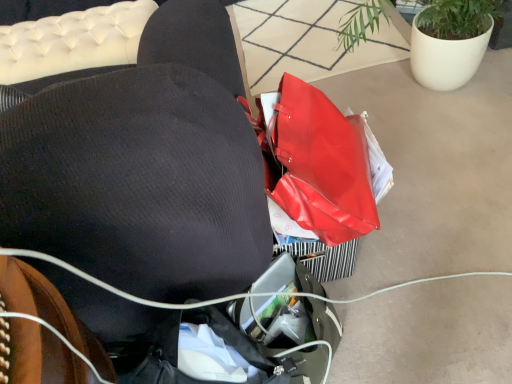
This screenshot has height=384, width=512. In order to click on matte white pot at upper right in this screenshot , I will do `click(450, 41)`.

Image resolution: width=512 pixels, height=384 pixels. Describe the element at coordinates (450, 41) in the screenshot. I see `matte white pot at upper right` at that location.

The height and width of the screenshot is (384, 512). I want to click on black fabric bean bag chair at center, so click(144, 166).

What do you see at coordinates (144, 166) in the screenshot? This screenshot has width=512, height=384. I see `black fabric bean bag chair at center` at bounding box center [144, 166].

Identify the location of matte white pot at upper right. (450, 41).

Is matte white pot at upper right to the right of black fabric bean bag chair at center from the viewer's perspective?

Indeed, matte white pot at upper right is positioned on the right side of black fabric bean bag chair at center.

Between matte white pot at upper right and black fabric bean bag chair at center, which one is positioned behind?

Positioned behind is matte white pot at upper right.

Considering the positions of points (352, 29) and (169, 120), is point (352, 29) closer to camera compared to point (169, 120)?

No, (352, 29) is behind (169, 120).

From the image's perspective, is matte white pot at upper right located above or below black fabric bean bag chair at center?

matte white pot at upper right is above black fabric bean bag chair at center.

From a real-world perspective, is matte white pot at upper right physically located above or below black fabric bean bag chair at center?

matte white pot at upper right is below black fabric bean bag chair at center.

Considering the sizes of matte white pot at upper right and black fabric bean bag chair at center in the image, is matte white pot at upper right wider or thinner than black fabric bean bag chair at center?

In the image, matte white pot at upper right appears to be more narrow than black fabric bean bag chair at center.

Who is taller, matte white pot at upper right or black fabric bean bag chair at center?

black fabric bean bag chair at center is taller.

Which of these two, matte white pot at upper right or black fabric bean bag chair at center, is bigger?

With larger size is black fabric bean bag chair at center.

Is matte white pot at upper right not within black fabric bean bag chair at center?

matte white pot at upper right is positioned outside black fabric bean bag chair at center.

In the scene shown: Would you consider matte white pot at upper right to be distant from black fabric bean bag chair at center?

Yes, matte white pot at upper right is far from black fabric bean bag chair at center.

Is matte white pot at upper right aimed at black fabric bean bag chair at center?

Yes, matte white pot at upper right is facing black fabric bean bag chair at center.

Locate an element on the screen. The height and width of the screenshot is (384, 512). houseplant below the black fabric bean bag chair at center (from a real-world perspective) is located at coordinates (450, 41).

Considering the positions of objects black fabric bean bag chair at center and matte white pot at upper right in the image provided, who is more to the left, black fabric bean bag chair at center or matte white pot at upper right?

black fabric bean bag chair at center.

Which object is further away from the camera taking this photo, black fabric bean bag chair at center or matte white pot at upper right?

matte white pot at upper right is behind.

Is point (42, 146) closer to viewer compared to point (438, 67)?

Yes.

From the image's perspective, which is above, black fabric bean bag chair at center or matte white pot at upper right?

From the image's view, matte white pot at upper right is above.

From a real-world perspective, is black fabric bean bag chair at center on matte white pot at upper right?

Yes, from a real-world perspective, black fabric bean bag chair at center is above matte white pot at upper right.

Looking at their sizes, would you say black fabric bean bag chair at center is wider or thinner than matte white pot at upper right?

Considering their sizes, black fabric bean bag chair at center looks broader than matte white pot at upper right.

Considering the relative sizes of black fabric bean bag chair at center and matte white pot at upper right in the image provided, is black fabric bean bag chair at center shorter than matte white pot at upper right?

Incorrect, the height of black fabric bean bag chair at center does not fall short of that of matte white pot at upper right.

Between black fabric bean bag chair at center and matte white pot at upper right, which one has smaller size?

matte white pot at upper right is smaller.

Is black fabric bean bag chair at center inside or outside of matte white pot at upper right?

black fabric bean bag chair at center cannot be found inside matte white pot at upper right.

Are black fabric bean bag chair at center and matte white pot at upper right located far from each other?

Absolutely, black fabric bean bag chair at center is distant from matte white pot at upper right.

Is black fabric bean bag chair at center aimed at matte white pot at upper right?

No, black fabric bean bag chair at center is not aimed at matte white pot at upper right.

Where is `houseplant located above the black fabric bean bag chair at center (from the image's perspective)`? The image size is (512, 384). houseplant located above the black fabric bean bag chair at center (from the image's perspective) is located at coordinates (450, 41).

This screenshot has width=512, height=384. I want to click on bean bag chair below the matte white pot at upper right (from the image's perspective), so click(x=144, y=166).

Locate an element on the screen. bean bag chair lying on the left of matte white pot at upper right is located at coordinates (144, 166).